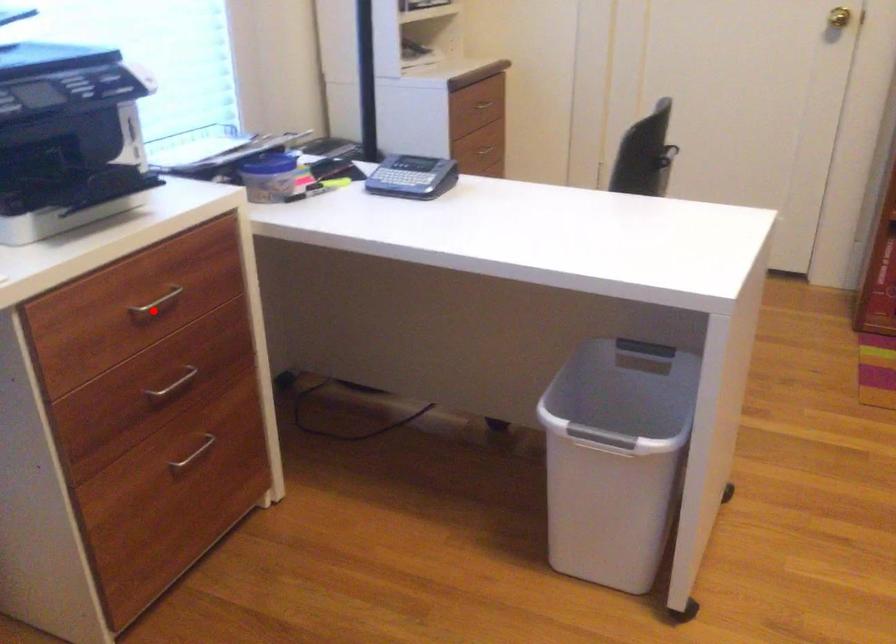
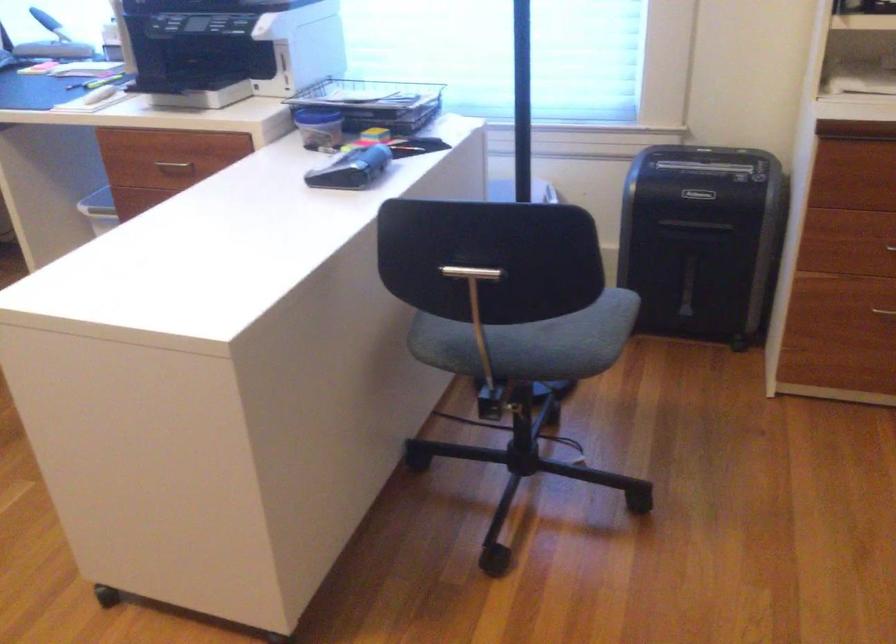
Find the pixel in the second image that matches the highlighted location in the first image.

(174, 165)